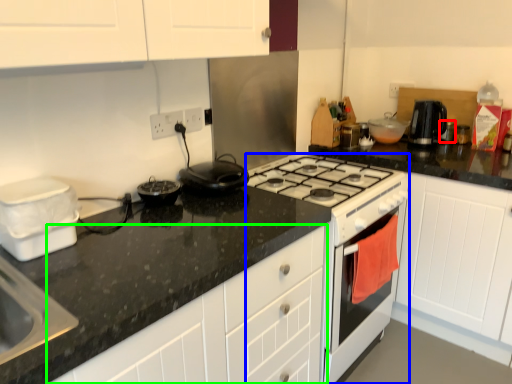
Question: Which object is positioned closest to appliance (highlighted by a red box)? Select from appliance (highlighted by a blue box) and cabinetry (highlighted by a green box).

Choices:
 (A) appliance
 (B) cabinetry

Answer: (A)